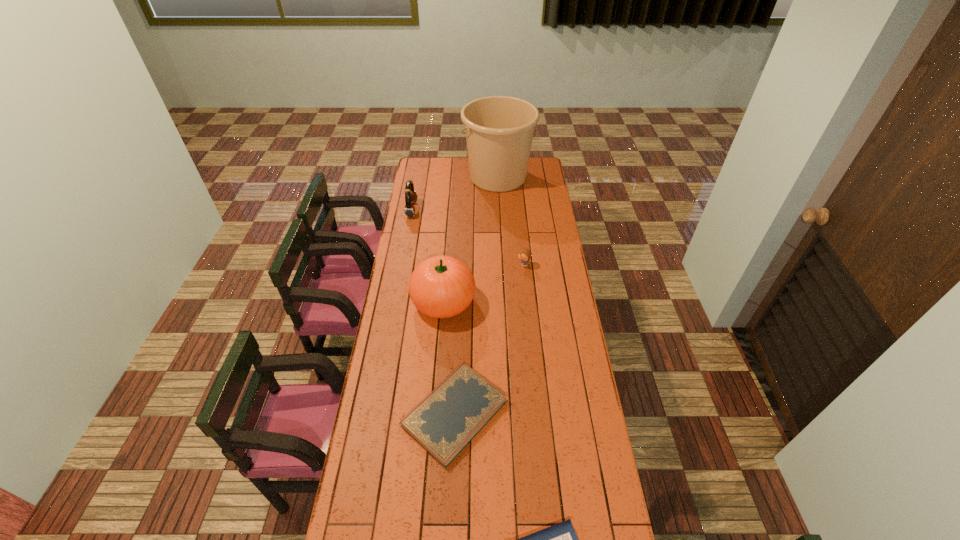
The height and width of the screenshot is (540, 960). Identify the location of the tallest object. (499, 130).

This screenshot has width=960, height=540. Find the location of `bucket`. bucket is located at coordinates (499, 130).

The height and width of the screenshot is (540, 960). I want to click on the second tallest object, so click(x=442, y=286).

Where is `the fourth farthest object`? The image size is (960, 540). the fourth farthest object is located at coordinates (442, 286).

Locate an element on the screen. The width and height of the screenshot is (960, 540). the third tallest object is located at coordinates (410, 195).

You are a GUI agent. You are given a task and a screenshot of the screen. Output one action in this format:
    pyautogui.click(x=<x>, y=<y>)
    Task: Click on the second farthest object
    
    Given the screenshot: What is the action you would take?
    pyautogui.click(x=410, y=195)

I want to click on the fourth nearest object, so 525,254.

Where is `the third shortest object`? This screenshot has height=540, width=960. the third shortest object is located at coordinates (525, 254).

Find the location of `the second shortest object`. the second shortest object is located at coordinates (443, 423).

I want to click on the fifth farthest object, so click(443, 423).